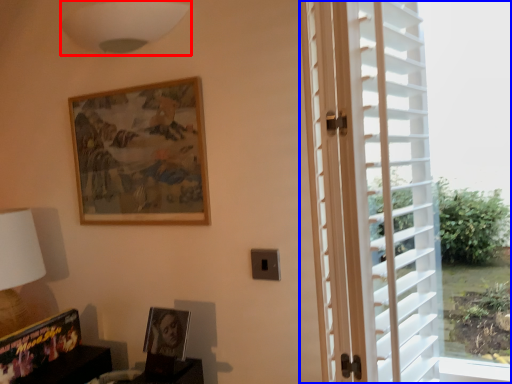
Question: Which object is further to the camera taking this photo, lamp (highlighted by a red box) or window (highlighted by a blue box)?

Choices:
 (A) lamp
 (B) window

Answer: (A)